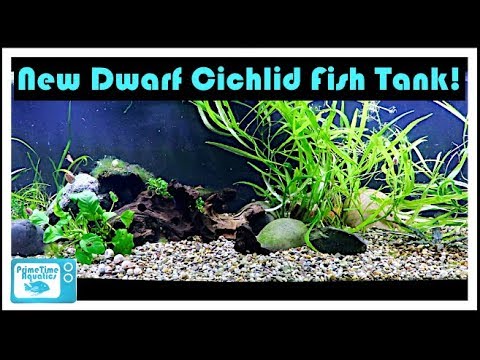
You are a GUI agent. You are given a task and a screenshot of the screen. Output one action in this format:
    pyautogui.click(x=<x>, y=<y>)
    Task: Click on the fish tank
    
    Given the screenshot: What is the action you would take?
    pyautogui.click(x=46, y=120), pyautogui.click(x=434, y=130), pyautogui.click(x=274, y=278)